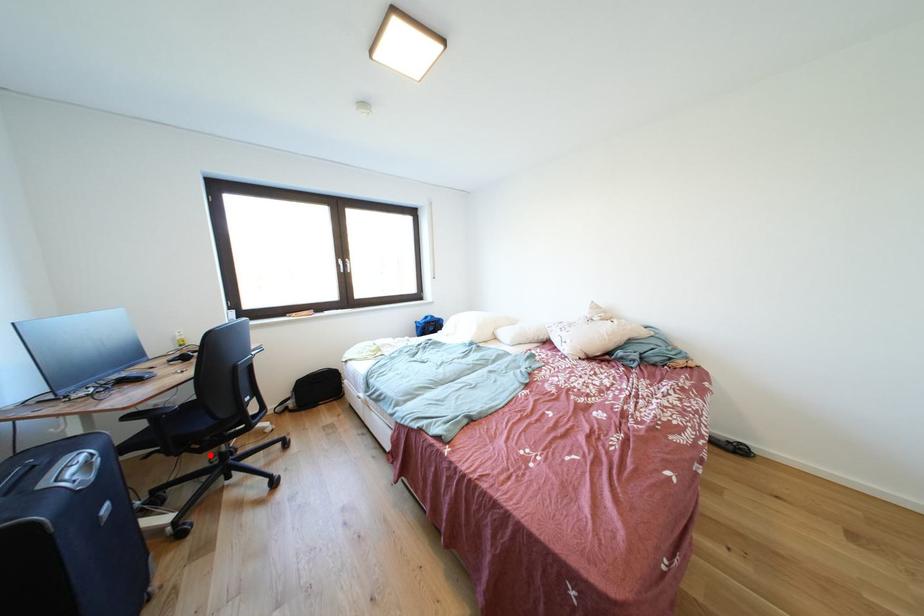
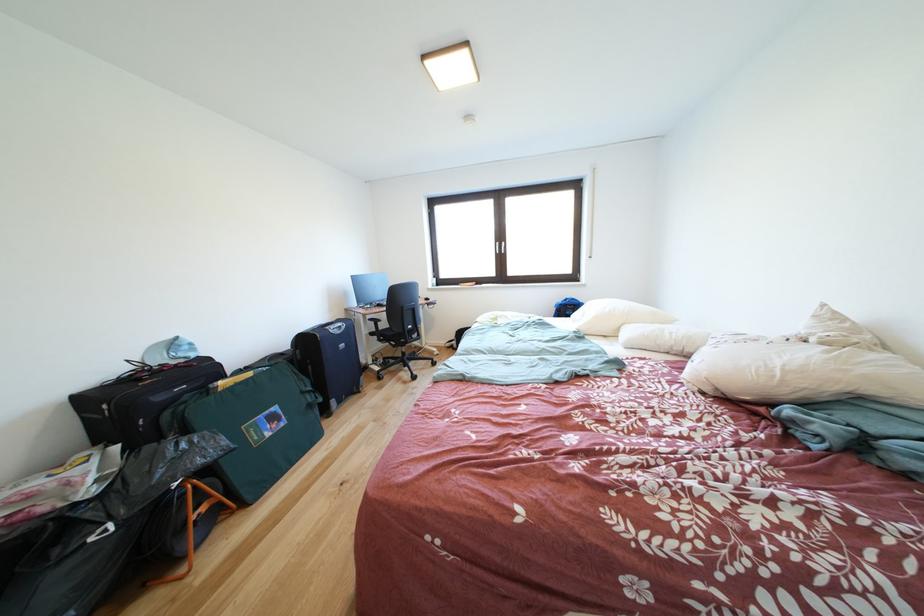
Locate, in the second image, the point that corresponds to the highlighted location in the first image.

(403, 351)